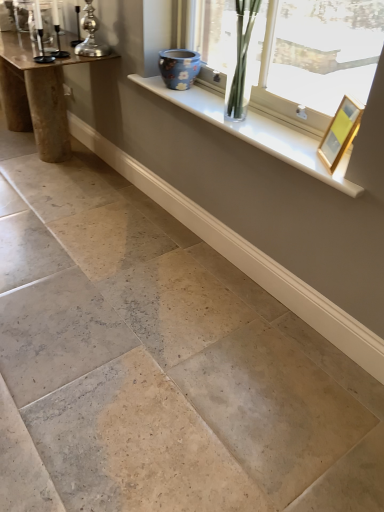
The width and height of the screenshot is (384, 512). I want to click on vacant space that is to the left of blue floral ceramic vase at upper center, so click(x=146, y=79).